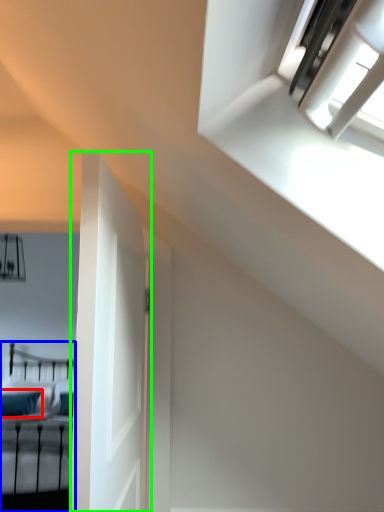
Question: Which object is the farthest from pillow (highlighted by a red box)? Choose among these: bed (highlighted by a blue box) or door (highlighted by a green box).

Choices:
 (A) bed
 (B) door

Answer: (B)